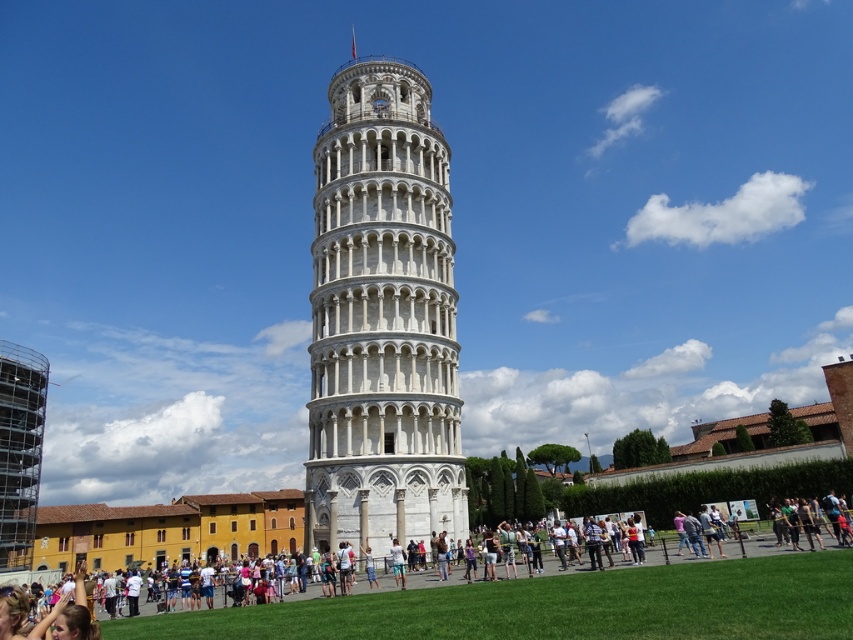
Question: Does white marble tower at center appear on the left side of white stone tower at center?

Choices:
 (A) no
 (B) yes

Answer: (B)

Question: Does white marble tower at center appear under white stone tower at center?

Choices:
 (A) yes
 (B) no

Answer: (B)

Question: Among these objects, which one is farthest from the camera?

Choices:
 (A) white marble tower at center
 (B) white stone tower at center

Answer: (A)

Question: Can you confirm if white marble tower at center is smaller than white stone tower at center?

Choices:
 (A) no
 (B) yes

Answer: (A)

Question: Which object appears farthest from the camera in this image?

Choices:
 (A) white stone tower at center
 (B) white marble tower at center

Answer: (B)

Question: Which point is closer to the camera?

Choices:
 (A) (418, 96)
 (B) (419, 621)

Answer: (B)